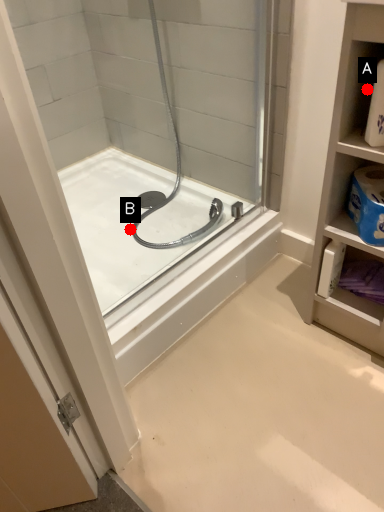
Question: Two points are circled on the image, labeled by A and B beside each circle. Which point appears farthest from the camera in this image?

Choices:
 (A) A is further
 (B) B is further

Answer: (B)